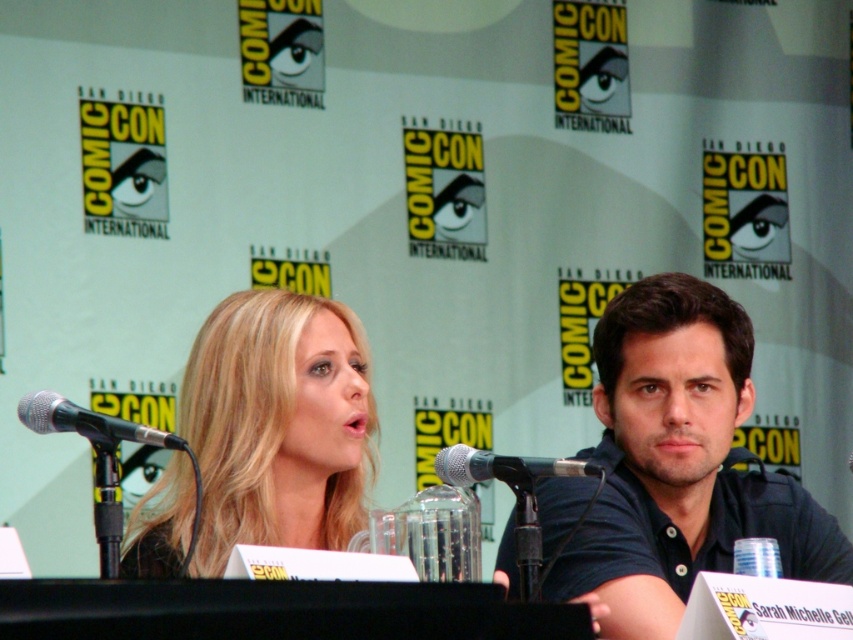
Question: Estimate the real-world distances between objects in this image. Which object is closer to the silver metallic microphone at left?

Choices:
 (A) black metallic microphone at center
 (B) blonde hair at center

Answer: (A)

Question: Which point is farther to the camera?

Choices:
 (A) (706, 304)
 (B) (570, 458)
 (C) (218, 332)

Answer: (A)

Question: Which object appears closest to the camera in this image?

Choices:
 (A) dark blue polo shirt at center
 (B) black metallic microphone at center
 (C) silver metallic microphone at left
 (D) blonde hair at center

Answer: (C)

Question: Observing the image, what is the correct spatial positioning of blonde hair at center in reference to black metallic microphone at center?

Choices:
 (A) below
 (B) above

Answer: (A)

Question: Is blonde hair at center to the left of black metallic microphone at center from the viewer's perspective?

Choices:
 (A) no
 (B) yes

Answer: (B)

Question: Can you confirm if dark blue polo shirt at center is positioned above blonde hair at center?

Choices:
 (A) no
 (B) yes

Answer: (A)